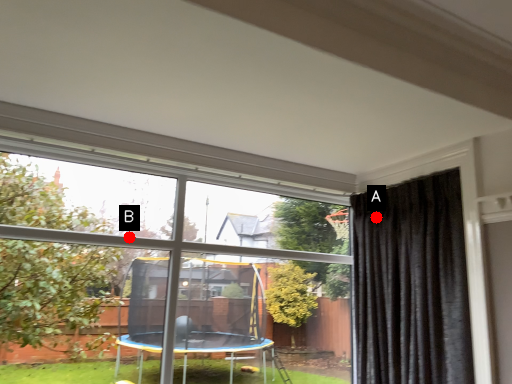
Question: Two points are circled on the image, labeled by A and B beside each circle. Which point is closer to the camera taking this photo?

Choices:
 (A) A is closer
 (B) B is closer

Answer: (A)